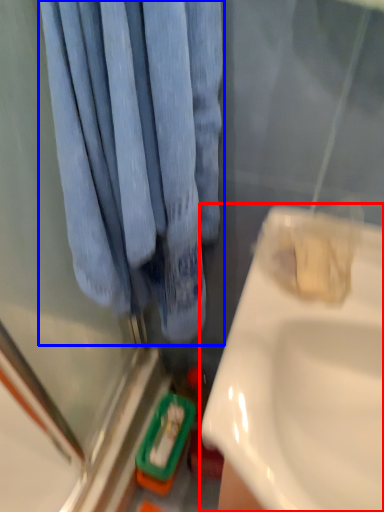
Question: Which of the following is the closest to the observer, sink (highlighted by a red box) or curtain (highlighted by a blue box)?

Choices:
 (A) sink
 (B) curtain

Answer: (B)